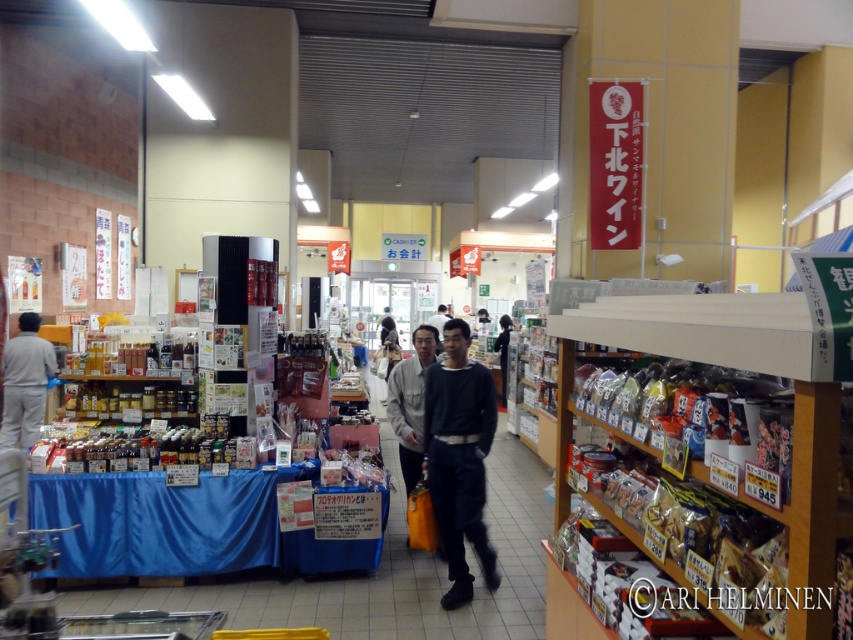
Does dark blue sweater at center have a lesser width compared to dark gray sweater at center?

Correct, dark blue sweater at center's width is less than dark gray sweater at center's.

The height and width of the screenshot is (640, 853). In order to click on dark blue sweater at center in this screenshot , I will do `click(459, 458)`.

Which is more to the left, dark blue sweater at center or gray matte clothing at left?

gray matte clothing at left is more to the left.

Between point (448, 333) and point (41, 355), which one is positioned in front?

Point (448, 333)

Which is in front, point (467, 483) or point (12, 385)?

Point (467, 483)

Locate an element on the screen. The height and width of the screenshot is (640, 853). dark blue sweater at center is located at coordinates (459, 458).

The height and width of the screenshot is (640, 853). I want to click on dark blue sweater at center, so click(x=459, y=458).

Does point (426, 428) lie behind point (415, 467)?

No, it is in front of (415, 467).

Does point (483, 560) lie behind point (421, 371)?

That is False.

The width and height of the screenshot is (853, 640). What are the coordinates of `dark blue sweater at center` in the screenshot? It's located at (459, 458).